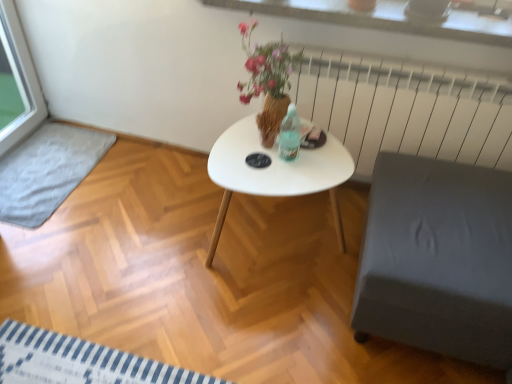
Identify the location of free space in front of white matte coffee table at center. (257, 329).